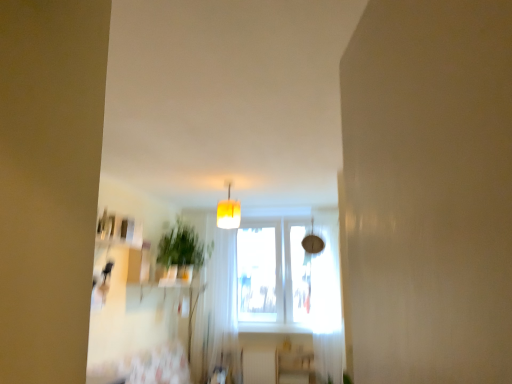
Question: Can you confirm if yellow fabric lampshade at center is shorter than wooden shelf at lower center?

Choices:
 (A) no
 (B) yes

Answer: (B)

Question: From a real-world perspective, is yellow fabric lampshade at center below wooden shelf at lower center?

Choices:
 (A) yes
 (B) no

Answer: (B)

Question: From the image's perspective, is yellow fabric lampshade at center over wooden shelf at lower center?

Choices:
 (A) no
 (B) yes

Answer: (B)

Question: Is the depth of yellow fabric lampshade at center greater than that of wooden shelf at lower center?

Choices:
 (A) yes
 (B) no

Answer: (B)

Question: Can you confirm if yellow fabric lampshade at center is taller than wooden shelf at lower center?

Choices:
 (A) no
 (B) yes

Answer: (A)

Question: In terms of height, does yellow fabric lampshade at center look taller or shorter compared to white sheer curtain at right, which appears as the 1th curtain when viewed from the right?

Choices:
 (A) tall
 (B) short

Answer: (B)

Question: From the image's perspective, is yellow fabric lampshade at center positioned above or below white sheer curtain at right, which appears as the 1th curtain when viewed from the right?

Choices:
 (A) above
 (B) below

Answer: (A)

Question: Is yellow fabric lampshade at center wider or thinner than white sheer curtain at right, which appears as the 2th curtain when viewed from the left?

Choices:
 (A) thin
 (B) wide

Answer: (B)

Question: From a real-world perspective, is yellow fabric lampshade at center positioned above or below white sheer curtain at right, which appears as the 1th curtain when viewed from the right?

Choices:
 (A) below
 (B) above

Answer: (B)

Question: From a real-world perspective, relative to green leafy plant at center, is wooden shelf at lower center vertically above or below?

Choices:
 (A) above
 (B) below

Answer: (B)

Question: In terms of width, does wooden shelf at lower center look wider or thinner when compared to green leafy plant at center?

Choices:
 (A) thin
 (B) wide

Answer: (A)

Question: Is wooden shelf at lower center bigger or smaller than green leafy plant at center?

Choices:
 (A) big
 (B) small

Answer: (B)

Question: Considering the positions of wooden shelf at lower center and green leafy plant at center in the image, is wooden shelf at lower center taller or shorter than green leafy plant at center?

Choices:
 (A) short
 (B) tall

Answer: (A)

Question: In terms of height, does yellow fabric lampshade at center look taller or shorter compared to green leafy plant at center?

Choices:
 (A) tall
 (B) short

Answer: (B)

Question: Is point (229, 218) closer or farther from the camera than point (160, 249)?

Choices:
 (A) farther
 (B) closer

Answer: (B)